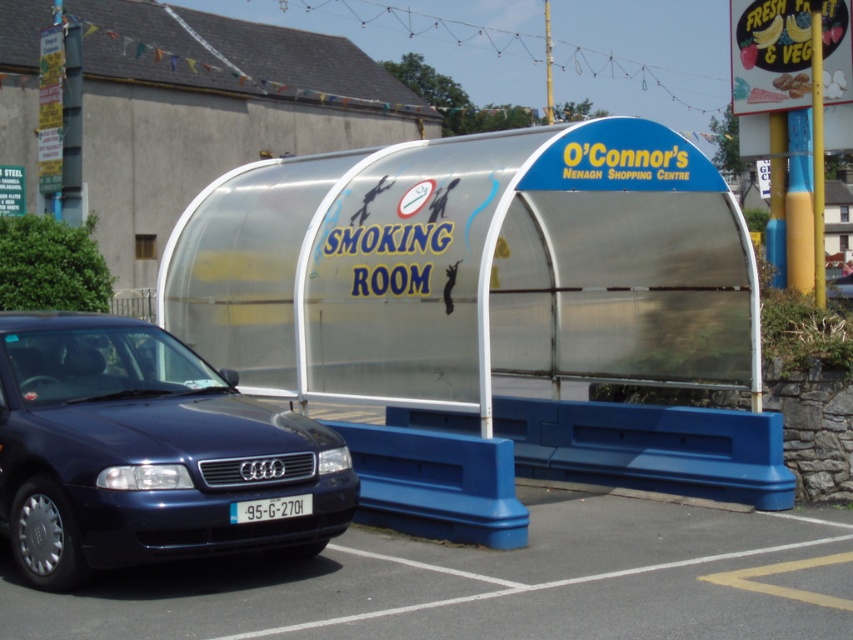
Who is shorter, smooth asphalt parking lot at lower left or white plastic license plate at center?

Standing shorter between the two is smooth asphalt parking lot at lower left.

Does point (485, 634) lie behind point (289, 508)?

No.

Is point (668, 634) closer to viewer compared to point (276, 512)?

Yes, it is.

What are the coordinates of `smooth asphalt parking lot at lower left` in the screenshot? It's located at (491, 582).

Is smooth asphalt parking lot at lower left to the right of metallic blue sedan at lower left from the viewer's perspective?

Yes, smooth asphalt parking lot at lower left is to the right of metallic blue sedan at lower left.

Is point (756, 531) behind point (234, 396)?

Yes, it is behind point (234, 396).

This screenshot has width=853, height=640. Identify the location of smooth asphalt parking lot at lower left. (491, 582).

This screenshot has height=640, width=853. I want to click on smooth asphalt parking lot at lower left, so click(x=491, y=582).

Is transparent plastic smoking room at center positioned behind metallic blue sedan at lower left?

Yes, transparent plastic smoking room at center is behind metallic blue sedan at lower left.

Is transparent plastic smoking room at center smaller than metallic blue sedan at lower left?

Correct, transparent plastic smoking room at center occupies less space than metallic blue sedan at lower left.

Who is more forward, (x=579, y=170) or (x=244, y=433)?

Point (x=244, y=433) is more forward.

Locate an element on the screen. transparent plastic smoking room at center is located at coordinates (463, 292).